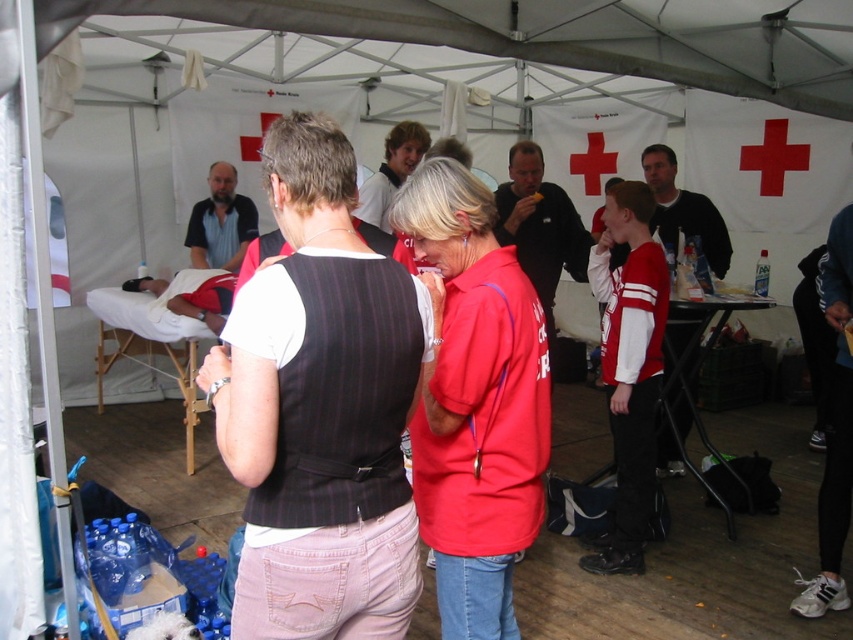
Question: Does matte red polo shirt at center appear over smooth white shirt at center?

Choices:
 (A) no
 (B) yes

Answer: (A)

Question: Estimate the real-world distances between objects in this image. Which object is closer to the smooth white shirt at center?

Choices:
 (A) matte black shirt at center
 (B) black pinstripe vest at center
 (C) dark brown hair at center

Answer: (A)

Question: Which of the following is the farthest from the observer?

Choices:
 (A) smooth white shirt at center
 (B) dark gray sweater at center

Answer: (B)

Question: Based on their relative distances, which object is farther from the dark brown hair at center?

Choices:
 (A) dark gray sweater at center
 (B) smooth white shirt at center
 (C) matte red polo shirt at center
 (D) matte black shirt at center

Answer: (C)

Question: Observing the image, what is the correct spatial positioning of matte black shirt at center in reference to dark brown hair at center?

Choices:
 (A) left
 (B) right

Answer: (B)

Question: Does matte red polo shirt at center appear on the right side of dark gray sweater at center?

Choices:
 (A) no
 (B) yes

Answer: (A)